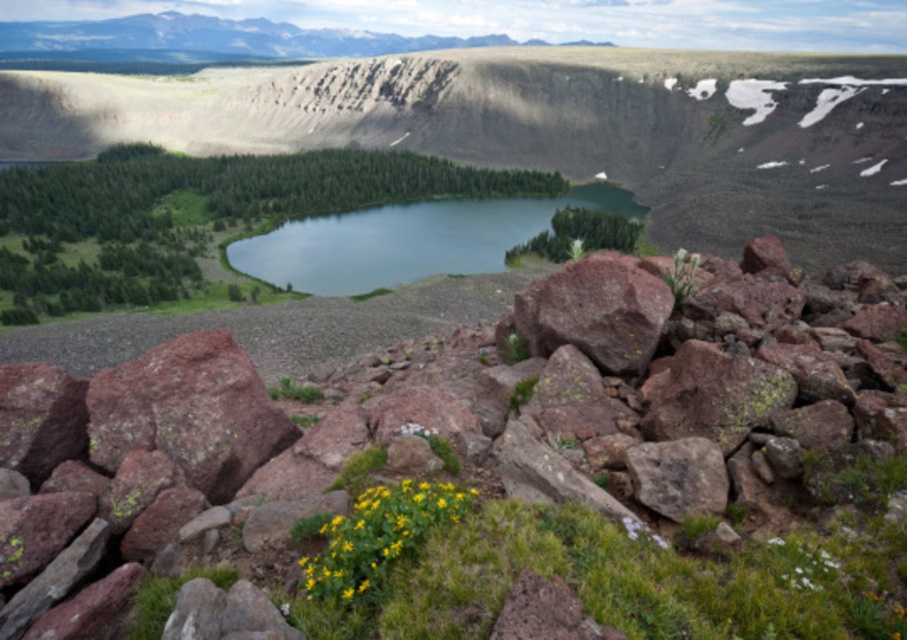
Based on the photo, you are a hiker who wants to cross the green glossy water at center. You have a 1.2 meter long wooden plank. Can you use the rusty rock at center as a support to cross the water?

The rusty rock at center is not as tall as the green glossy water at center, so the rock is shorter than the water. Since the plank is 1.2 meters long, it might not be sufficient to span the gap unless the distance between the starting point and the rock is less than 1.2 meters. However, without knowing the exact distance, it is uncertain if the plank will reach.

You are a hiker standing at the edge of the rocky terrain. You see the green glossy water at center and the yellow matte flower at center. Which object is closer to you?

The green glossy water at center is closer to you because the yellow matte flower at center is behind it.